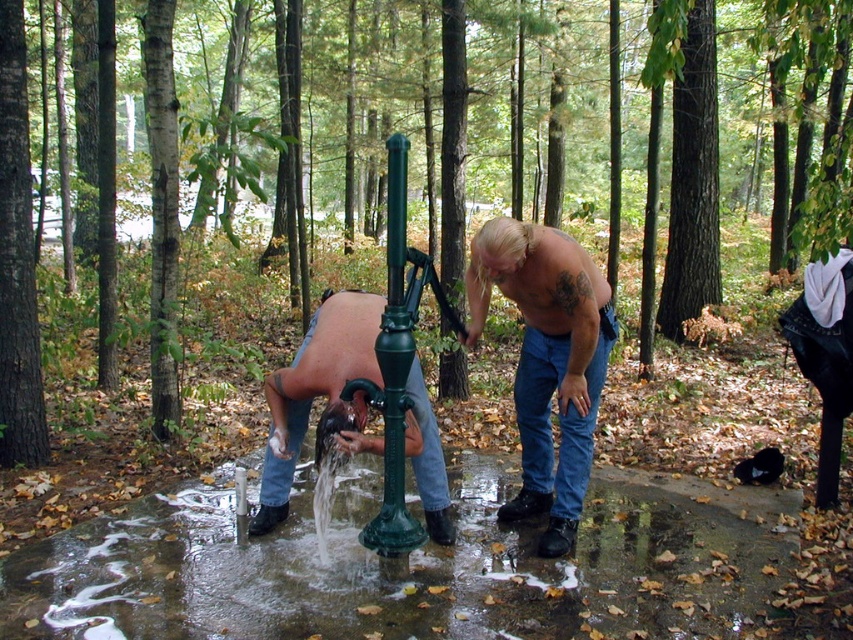
You are a hiker who needs to fill your water bottle. You see the shiny blue jeans at center and the shiny metallic faucet at center. Which object should you interact with to get water?

The shiny metallic faucet at center is the object to interact with to get water, as the shiny blue jeans at center is located above it and likely belongs to someone else.

You are a construction worker who needs to place a 1.2 meter wide equipment between the wet concrete puddle at lower center and the shiny metallic faucet at center. Can the equipment fit between them?

The wet concrete puddle at lower center might be wider than the shiny metallic faucet at center, so the equipment might not fit between them if the distance is less than 1.2 meters. Check the actual distance before placing the equipment.